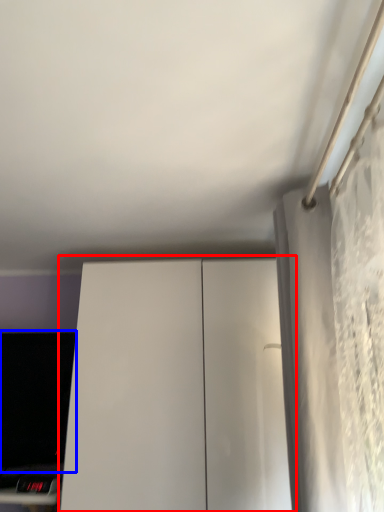
Question: Which point is closer to the camera, dresser (highlighted by a red box) or computer monitor (highlighted by a blue box)?

Choices:
 (A) dresser
 (B) computer monitor

Answer: (A)